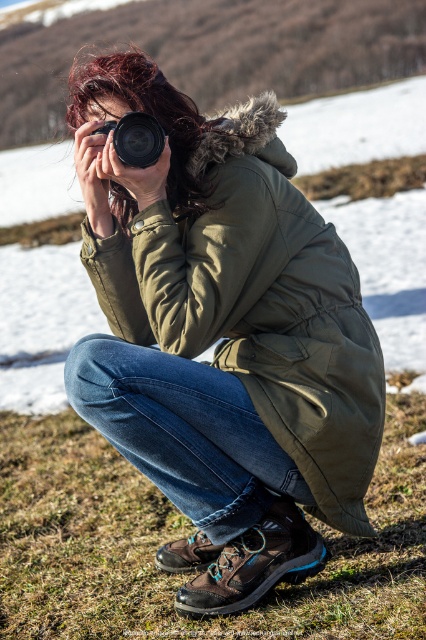
Question: Can you confirm if denim jeans at lower center is positioned below black plastic camera at center?

Choices:
 (A) no
 (B) yes

Answer: (B)

Question: Which point appears closest to the camera in this image?

Choices:
 (A) (126, 371)
 (B) (118, 333)
 (C) (143, 161)

Answer: (A)

Question: Which of the following is the farthest from the observer?

Choices:
 (A) olive green parka at center
 (B) black plastic camera at center
 (C) denim jeans at lower center

Answer: (B)

Question: Is olive green parka at center to the left of denim jeans at lower center from the viewer's perspective?

Choices:
 (A) no
 (B) yes

Answer: (A)

Question: Considering the real-world distances, which object is closest to the olive green parka at center?

Choices:
 (A) black plastic camera at center
 (B) denim jeans at lower center

Answer: (B)

Question: Is olive green parka at center bigger than denim jeans at lower center?

Choices:
 (A) yes
 (B) no

Answer: (A)